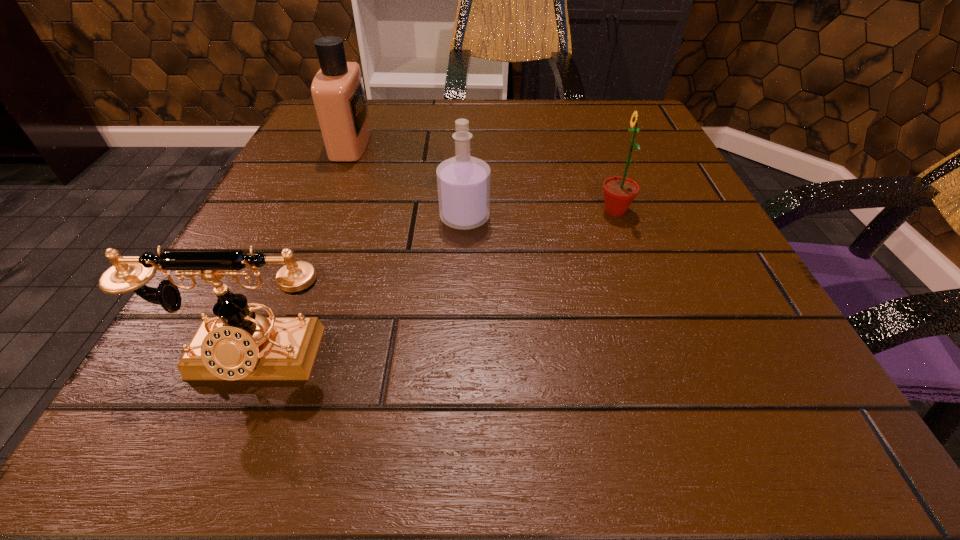
Identify the location of vacant position located on the right of the second object from right to left. This screenshot has width=960, height=540. (540, 218).

At what (x,y) coordinates should I click in order to perform the action: click on object that is at the far edge. Please return your answer as a coordinate pair (x, y). The height and width of the screenshot is (540, 960). Looking at the image, I should click on (337, 89).

Image resolution: width=960 pixels, height=540 pixels. Identify the location of object that is at the near edge. (237, 344).

This screenshot has height=540, width=960. I want to click on perfume present at the left edge, so click(337, 89).

In order to click on telephone that is at the left edge in this screenshot , I will do `click(237, 344)`.

You are a GUI agent. You are given a task and a screenshot of the screen. Output one action in this format:
    pyautogui.click(x=<x>, y=<y>)
    Task: Click on the object present at the right edge
    Image resolution: width=960 pixels, height=540 pixels.
    Given the screenshot: What is the action you would take?
    pyautogui.click(x=619, y=192)

Where is `object present at the far left corner`? The height and width of the screenshot is (540, 960). object present at the far left corner is located at coordinates (337, 89).

Image resolution: width=960 pixels, height=540 pixels. Identify the location of object that is at the near left corner. (237, 344).

Identify the location of free space at the far edge of the desktop. The width and height of the screenshot is (960, 540). (x=540, y=111).

This screenshot has width=960, height=540. I want to click on free region at the left edge, so click(190, 321).